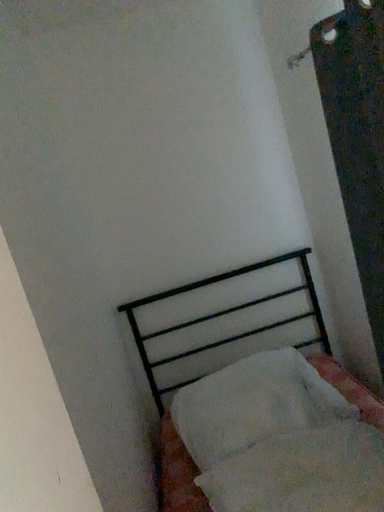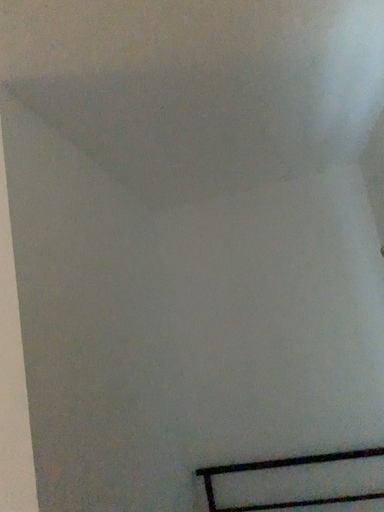
Question: Which way did the camera rotate in the video?

Choices:
 (A) rotated left
 (B) rotated right

Answer: (A)